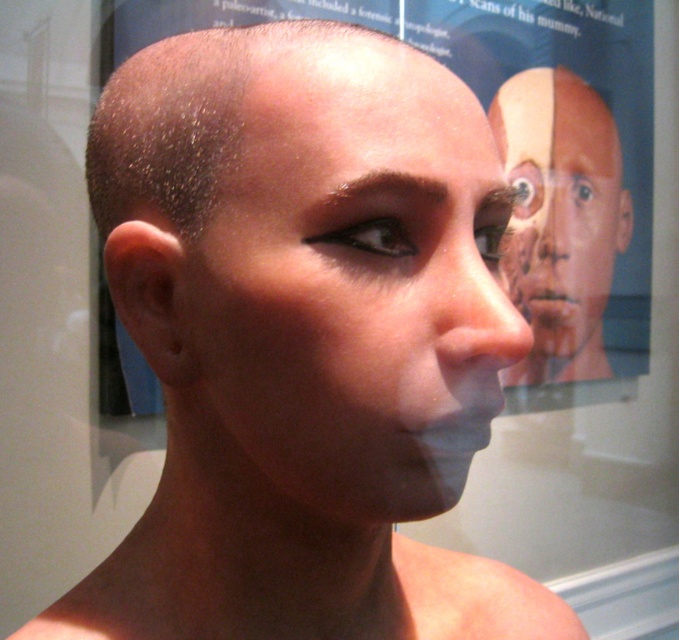
Question: Which point appears closest to the camera in this image?

Choices:
 (A) (456, 280)
 (B) (617, 186)

Answer: (A)

Question: Is smooth skin head at center behind matte skin face at center?

Choices:
 (A) yes
 (B) no

Answer: (B)

Question: Is smooth skin head at center smaller than matte skin face at center?

Choices:
 (A) no
 (B) yes

Answer: (B)

Question: Does smooth skin head at center appear over matte skin face at center?

Choices:
 (A) no
 (B) yes

Answer: (A)

Question: Which of the following is the closest to the observer?

Choices:
 (A) (390, 435)
 (B) (608, 259)

Answer: (A)